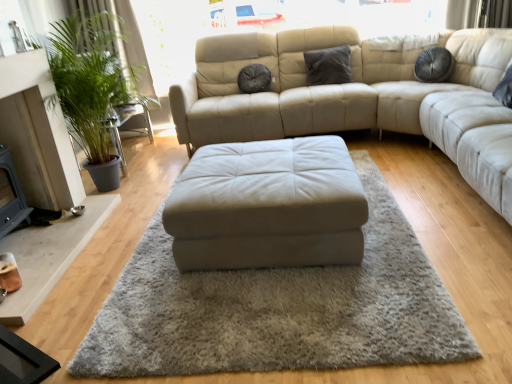
Describe the element at coordinates (94, 84) in the screenshot. I see `green leafy plant at left` at that location.

Where is `suede-like gray pillow at center, which appears as the 1th pillow when viewed from the left`? The height and width of the screenshot is (384, 512). suede-like gray pillow at center, which appears as the 1th pillow when viewed from the left is located at coordinates tap(254, 79).

Describe the element at coordinates (267, 206) in the screenshot. I see `beige leather ottoman at center` at that location.

The image size is (512, 384). Describe the element at coordinates (122, 42) in the screenshot. I see `green leafy plant at left` at that location.

This screenshot has height=384, width=512. Describe the element at coordinates (126, 124) in the screenshot. I see `green leafy plant at left` at that location.

You are a GUI agent. You are given a task and a screenshot of the screen. Output one action in this format:
    pyautogui.click(x=<x>, y=<y>)
    Task: Click on the green leafy plant at left
    The image size is (512, 384).
    Given the screenshot: What is the action you would take?
    pyautogui.click(x=94, y=84)

Considering the positions of points (312, 50) and (110, 320), is point (312, 50) closer to camera compared to point (110, 320)?

No, it is behind (110, 320).

From a real-world perspective, is dark gray fabric pillow at center, the 1th pillow in the right-to-left sequence, physically located above or below beige leather ottoman at center?

In terms of real-world spatial position, dark gray fabric pillow at center, the 1th pillow in the right-to-left sequence, is above beige leather ottoman at center.

Is the depth of dark gray fabric pillow at center, the 2th pillow viewed from the left, greater than that of beige leather ottoman at center?

Yes, it is.

Is dark gray fabric pillow at center, the 2th pillow viewed from the left, turned away from beige leather ottoman at center?

dark gray fabric pillow at center, the 2th pillow viewed from the left, is not turned away from beige leather ottoman at center.

From the picture: Is green leafy plant at left located within beige leather ottoman at center?

Definitely not — green leafy plant at left is not inside beige leather ottoman at center.

Is beige leather ottoman at center touching green leafy plant at left?

No, beige leather ottoman at center is not next to green leafy plant at left.

Is beige leather ottoman at center wider than green leafy plant at left?

Yes.

Who is smaller, beige leather ottoman at center or green leafy plant at left?

beige leather ottoman at center is smaller.

Would you say dark gray fabric pillow at center, the 1th pillow in the right-to-left sequence, is inside or outside suede-like gray pillow at center, acting as the second pillow starting from the right?

dark gray fabric pillow at center, the 1th pillow in the right-to-left sequence, exists outside the volume of suede-like gray pillow at center, acting as the second pillow starting from the right.

Does dark gray fabric pillow at center, the 2th pillow viewed from the left, have a smaller size compared to suede-like gray pillow at center, acting as the second pillow starting from the right?

No, dark gray fabric pillow at center, the 2th pillow viewed from the left, is not smaller than suede-like gray pillow at center, acting as the second pillow starting from the right.

Is dark gray fabric pillow at center, the 1th pillow in the right-to-left sequence, facing away from suede-like gray pillow at center, acting as the second pillow starting from the right?

dark gray fabric pillow at center, the 1th pillow in the right-to-left sequence, is not turned away from suede-like gray pillow at center, acting as the second pillow starting from the right.

From the image's perspective, is dark gray fabric pillow at center, the 2th pillow viewed from the left, located above or below suede-like gray pillow at center, which appears as the 1th pillow when viewed from the left?

dark gray fabric pillow at center, the 2th pillow viewed from the left, is situated higher than suede-like gray pillow at center, which appears as the 1th pillow when viewed from the left, in the image.

Does dark gray fabric pillow at center, the 1th pillow in the right-to-left sequence, have a smaller size compared to green leafy plant at left?

Yes, dark gray fabric pillow at center, the 1th pillow in the right-to-left sequence, is smaller than green leafy plant at left.

Can you see dark gray fabric pillow at center, the 1th pillow in the right-to-left sequence, touching green leafy plant at left?

No, dark gray fabric pillow at center, the 1th pillow in the right-to-left sequence, is not next to green leafy plant at left.

Which of these two, dark gray fabric pillow at center, the 2th pillow viewed from the left, or green leafy plant at left, stands taller?

green leafy plant at left is taller.

Is dark gray fabric pillow at center, the 1th pillow in the right-to-left sequence, wider or thinner than green leafy plant at left?

Considering their sizes, dark gray fabric pillow at center, the 1th pillow in the right-to-left sequence, looks slimmer than green leafy plant at left.

Can you tell me how much beige leather ottoman at center and beige leather ottoman at center differ in facing direction?

They differ by 2.22 degrees in their facing directions.

Would you say beige leather ottoman at center contains beige leather ottoman at center?

No, beige leather ottoman at center is not surrounded by beige leather ottoman at center.

Is beige leather ottoman at center in front of or behind beige leather ottoman at center in the image?

In the image, beige leather ottoman at center appears in front of beige leather ottoman at center.

From a real-world perspective, is beige leather ottoman at center physically located above or below beige leather ottoman at center?

Clearly, from a real-world perspective, beige leather ottoman at center is below beige leather ottoman at center.

Is beige leather ottoman at center facing away from green leafy plant at left?

No.

Is the depth of beige leather ottoman at center greater than that of green leafy plant at left?

No, beige leather ottoman at center is in front of green leafy plant at left.

Considering the sizes of objects beige leather ottoman at center and green leafy plant at left in the image provided, who is taller, beige leather ottoman at center or green leafy plant at left?

With more height is green leafy plant at left.

Which of these two, beige leather ottoman at center or green leafy plant at left, is bigger?

Bigger between the two is green leafy plant at left.

Is green leafy plant at left bigger or smaller than green leafy plant at left?

In the image, green leafy plant at left appears to be smaller than green leafy plant at left.

From the picture: Could you tell me if green leafy plant at left is facing green leafy plant at left?

Yes, green leafy plant at left is facing green leafy plant at left.

Between green leafy plant at left and green leafy plant at left, which one has smaller width?

Thinner between the two is green leafy plant at left.

Is green leafy plant at left inside or outside of green leafy plant at left?

The correct answer is: inside.

At what (x,y) coordinates should I click in order to perform the action: click on pillow on the right of beige leather ottoman at center. Please return your answer as a coordinate pair (x, y). Looking at the image, I should click on (328, 66).

I want to click on plant on the left of beige leather ottoman at center, so click(x=94, y=84).

Based on their spatial positions, is green leafy plant at left or beige leather ottoman at center closer to green leafy plant at left?

green leafy plant at left lies closer to green leafy plant at left than the other object.

From the image, which object appears to be nearer to green leafy plant at left, green leafy plant at left or green leafy plant at left?

green leafy plant at left lies closer to green leafy plant at left than the other object.

Considering their positions, is beige leather ottoman at center positioned further to green leafy plant at left than suede-like gray pillow at center, which appears as the 1th pillow when viewed from the left?

Among the two, beige leather ottoman at center is located further to green leafy plant at left.

From the image, which object appears to be nearer to beige leather ottoman at center, green leafy plant at left or green leafy plant at left?

green leafy plant at left.

Which object lies nearer to the anchor point suede-like gray pillow at center, acting as the second pillow starting from the right, green leafy plant at left or green leafy plant at left?

Among the two, green leafy plant at left is located nearer to suede-like gray pillow at center, acting as the second pillow starting from the right.

Estimate the real-world distances between objects in this image. Which object is closer to beige leather ottoman at center, green leafy plant at left or green leafy plant at left?

green leafy plant at left.

When comparing their distances from suede-like gray pillow at center, acting as the second pillow starting from the right, does dark gray fabric pillow at center, the 1th pillow in the right-to-left sequence, or beige leather ottoman at center seem closer?

Among the two, dark gray fabric pillow at center, the 1th pillow in the right-to-left sequence, is located nearer to suede-like gray pillow at center, acting as the second pillow starting from the right.

From the image, which object appears to be farther from suede-like gray pillow at center, acting as the second pillow starting from the right, beige leather ottoman at center or dark gray fabric pillow at center, the 1th pillow in the right-to-left sequence?

beige leather ottoman at center is further to suede-like gray pillow at center, acting as the second pillow starting from the right.

What are the coordinates of `plant between beige leather ottoman at center and green leafy plant at left from front to back` in the screenshot? It's located at (94, 84).

You are a GUI agent. You are given a task and a screenshot of the screen. Output one action in this format:
    pyautogui.click(x=<x>, y=<y>)
    Task: Click on the footrest between green leafy plant at left and dark gray fabric pillow at center, the 1th pillow in the right-to-left sequence, in the horizontal direction
    
    Given the screenshot: What is the action you would take?
    pyautogui.click(x=267, y=206)

You are a GUI agent. You are given a task and a screenshot of the screen. Output one action in this format:
    pyautogui.click(x=<x>, y=<y>)
    Task: Click on the footrest between beige leather ottoman at center and green leafy plant at left from front to back
    
    Given the screenshot: What is the action you would take?
    pyautogui.click(x=267, y=206)

The image size is (512, 384). Identify the location of footrest between beige leather ottoman at center and dark gray fabric pillow at center, the 1th pillow in the right-to-left sequence, along the z-axis. (267, 206).